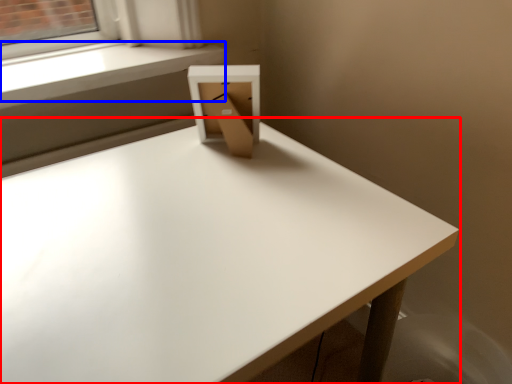
Question: Which of the following is the closest to the observer, table (highlighted by a red box) or window sill (highlighted by a blue box)?

Choices:
 (A) table
 (B) window sill

Answer: (A)